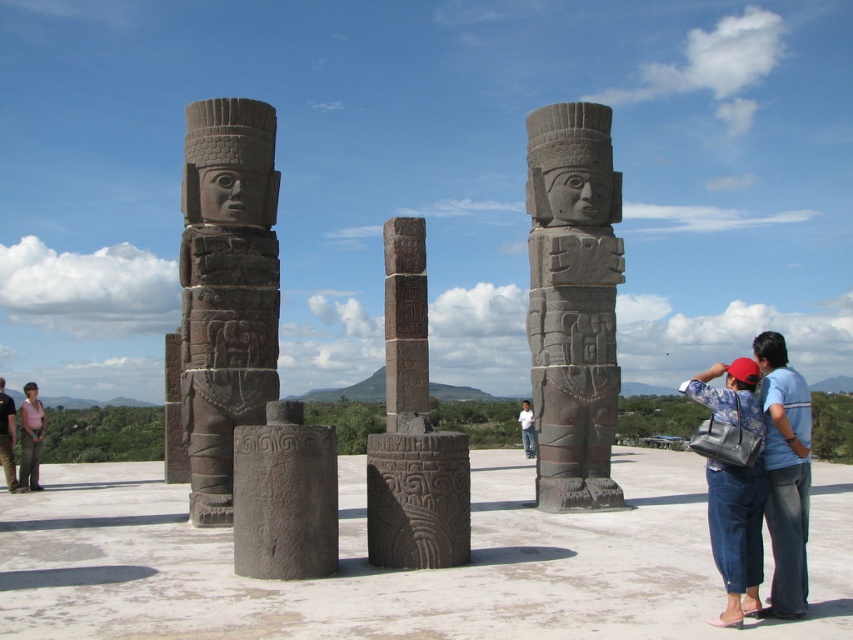
Question: Which object appears farthest from the camera in this image?

Choices:
 (A) black stone column at left
 (B) matte pink shirt at left

Answer: (B)

Question: Is denim jeans at center in front of dark gray stone column at center?

Choices:
 (A) yes
 (B) no

Answer: (A)

Question: Which point appears farthest from the camera in this image?

Choices:
 (A) (462, 557)
 (B) (329, 540)
 (C) (590, 148)
 (D) (1, 428)

Answer: (D)

Question: Does dark gray stone column at center have a larger size compared to dark brown leather jacket at lower left?

Choices:
 (A) no
 (B) yes

Answer: (B)

Question: Which point appears closest to the camera in this image?

Choices:
 (A) (540, 308)
 (B) (201, 227)

Answer: (B)

Question: Is dark gray stone statue at center to the left of dark gray stone totem pole at center from the viewer's perspective?

Choices:
 (A) no
 (B) yes

Answer: (A)